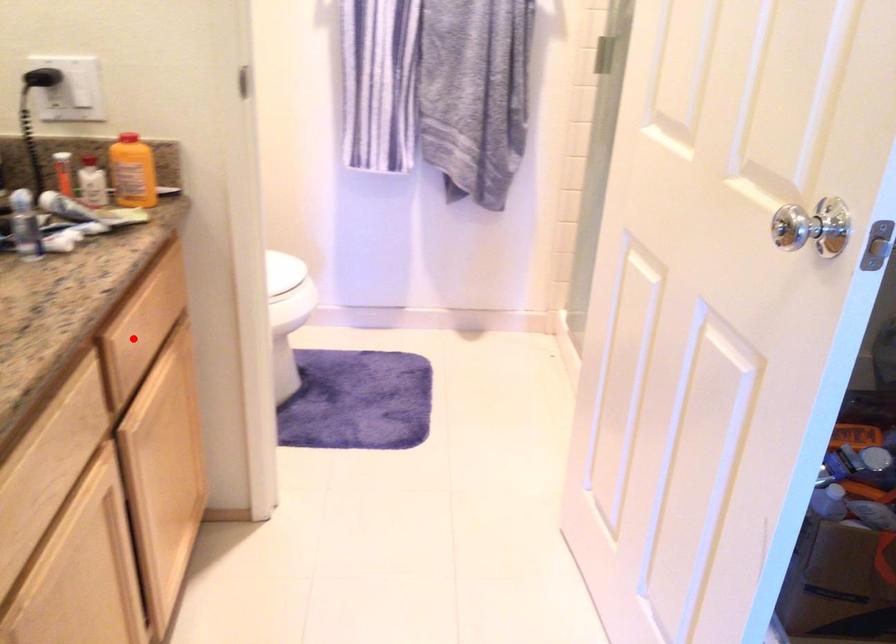
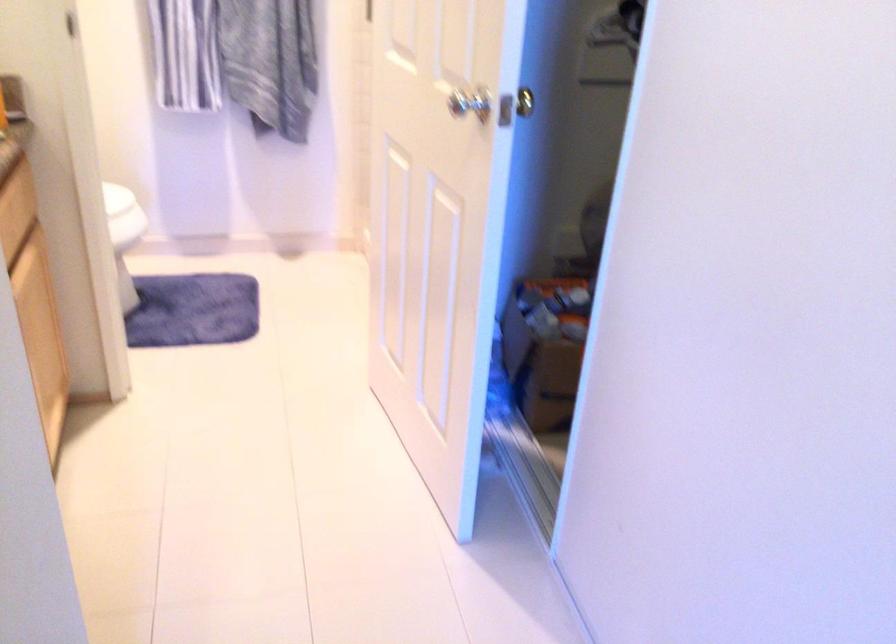
Question: I am providing you with two images of the same scene from different viewpoints. A red point is shown in image1. For the corresponding object point in image2, is it positioned nearer or farther from the camera?

Choices:
 (A) Nearer
 (B) Farther

Answer: (B)